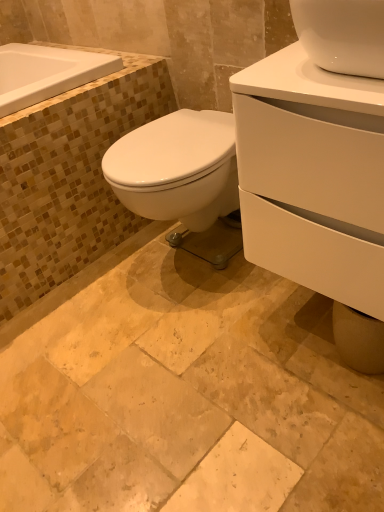
From the picture: What is the approximate width of natural stone tile at center?

It is 1.28 meters.

Image resolution: width=384 pixels, height=512 pixels. Find the location of `white glossy cabinet at right`. white glossy cabinet at right is located at coordinates (316, 188).

Does point (363, 449) come in front of point (46, 46)?

That is True.

From the image's perspective, which object appears higher, natural stone tile at center or white glossy bathtub at upper left?

white glossy bathtub at upper left, from the image's perspective.

Find the location of `bath above the natural stone tile at center (from the image's perspective)`. bath above the natural stone tile at center (from the image's perspective) is located at coordinates (46, 73).

Measure the distance from natural stone tile at center to white glossy bathtub at upper left.

natural stone tile at center and white glossy bathtub at upper left are 35.37 inches apart from each other.

Is white glossy bathtub at upper left with white glossy cabinet at right?

white glossy bathtub at upper left is not next to white glossy cabinet at right, and they're not touching.

Is point (20, 68) farther from viewer compared to point (350, 178)?

That is True.

Considering the sizes of objects white glossy bathtub at upper left and white glossy cabinet at right in the image provided, who is bigger, white glossy bathtub at upper left or white glossy cabinet at right?

Bigger between the two is white glossy cabinet at right.

Considering their positions, is white glossy cabinet at right located in front of or behind natural stone tile at center?

In the image, white glossy cabinet at right appears behind natural stone tile at center.

Is white glossy cabinet at right looking in the opposite direction of natural stone tile at center?

That's not correct — white glossy cabinet at right is not looking away from natural stone tile at center.

Which is more to the right, white glossy cabinet at right or natural stone tile at center?

white glossy cabinet at right.

From a real-world perspective, is white glossy cabinet at right above or below natural stone tile at center?

white glossy cabinet at right is situated higher than natural stone tile at center in the real world.

Is point (47, 82) closer to viewer compared to point (125, 500)?

That is False.

From a real-world perspective, who is located higher, white glossy bathtub at upper left or natural stone tile at center?

white glossy bathtub at upper left.

Between white glossy bathtub at upper left and natural stone tile at center, which one has smaller size?

white glossy bathtub at upper left.

Which object is more forward, natural stone tile at center or white glossy cabinet at right?

natural stone tile at center is more forward.

Would you say natural stone tile at center is outside white glossy cabinet at right?

Yes, natural stone tile at center is not within white glossy cabinet at right.

Between natural stone tile at center and white glossy cabinet at right, which one has more height?

With more height is white glossy cabinet at right.

From a real-world perspective, is natural stone tile at center positioned above or below white glossy cabinet at right?

natural stone tile at center is below white glossy cabinet at right.

Could you tell me if white glossy cabinet at right is turned towards white glossy bathtub at upper left?

No, white glossy cabinet at right is not oriented towards white glossy bathtub at upper left.

Where is `bath above the white glossy cabinet at right (from the image's perspective)`? This screenshot has width=384, height=512. bath above the white glossy cabinet at right (from the image's perspective) is located at coordinates (46, 73).

Is point (240, 181) closer or farther from the camera than point (62, 79)?

Point (240, 181) is positioned closer to the camera compared to point (62, 79).

Which is correct: white glossy cabinet at right is inside white glossy bathtub at upper left, or outside of it?

white glossy cabinet at right lies outside white glossy bathtub at upper left.

Find the location of a particular element. The width and height of the screenshot is (384, 512). bath lying on the left of natural stone tile at center is located at coordinates (46, 73).

Identify the location of porcelain to the right of white glossy bathtub at upper left. (316, 188).

From the image, which object appears to be nearer to white glossy cabinet at right, natural stone tile at center or white glossy bathtub at upper left?

natural stone tile at center is positioned closer to the anchor white glossy cabinet at right.

From the image, which object appears to be nearer to white glossy bathtub at upper left, white glossy cabinet at right or natural stone tile at center?

natural stone tile at center is positioned closer to the anchor white glossy bathtub at upper left.

Based on their spatial positions, is natural stone tile at center or white glossy cabinet at right further from white glossy bathtub at upper left?

white glossy cabinet at right.

Considering their positions, is white glossy bathtub at upper left positioned further to natural stone tile at center than white glossy cabinet at right?

Among the two, white glossy bathtub at upper left is located further to natural stone tile at center.

In the scene shown: Which object lies nearer to the anchor point white glossy cabinet at right, white glossy bathtub at upper left or natural stone tile at center?

natural stone tile at center is closer to white glossy cabinet at right.

Looking at the image, which one is located further to natural stone tile at center, white glossy cabinet at right or white glossy bathtub at upper left?

white glossy bathtub at upper left is further to natural stone tile at center.

Find the location of a particular element. This screenshot has width=384, height=512. ceramic tile situated between white glossy bathtub at upper left and white glossy cabinet at right from left to right is located at coordinates (184, 393).